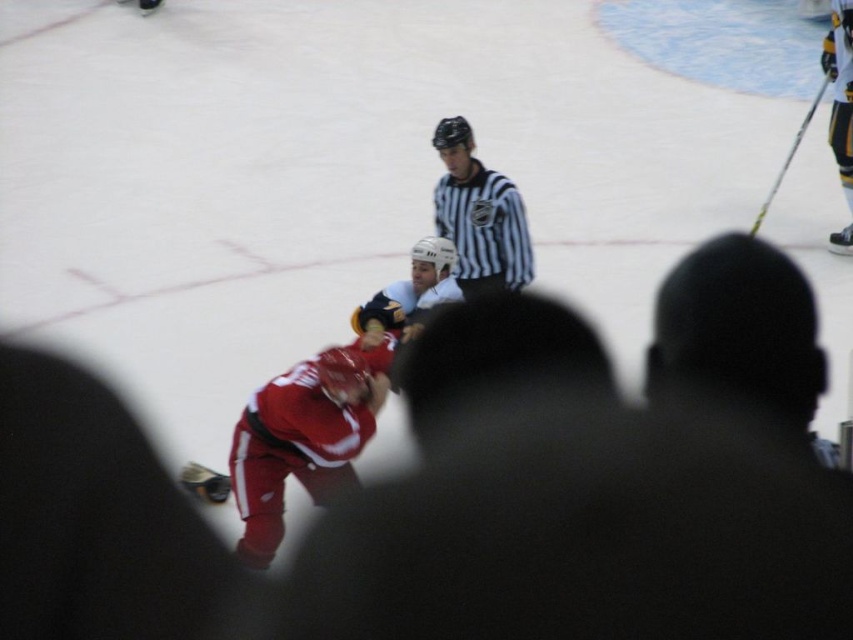
Question: Considering the relative positions of striped jersey at center and black metallic hockey stick at upper right in the image provided, where is striped jersey at center located with respect to black metallic hockey stick at upper right?

Choices:
 (A) right
 (B) left

Answer: (B)

Question: Can you confirm if striped jersey at center is thinner than black metallic hockey stick at upper right?

Choices:
 (A) yes
 (B) no

Answer: (A)

Question: Is striped jersey at center positioned before black metallic hockey stick at upper right?

Choices:
 (A) yes
 (B) no

Answer: (A)

Question: Among these objects, which one is nearest to the camera?

Choices:
 (A) striped jersey at center
 (B) black metallic hockey stick at upper right

Answer: (A)